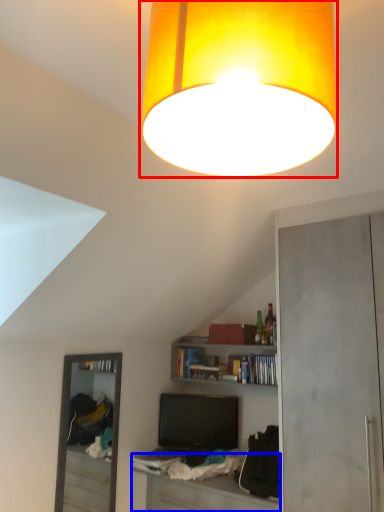
Question: Which point is further to the camera, lamp (highlighted by a red box) or table (highlighted by a blue box)?

Choices:
 (A) lamp
 (B) table

Answer: (B)